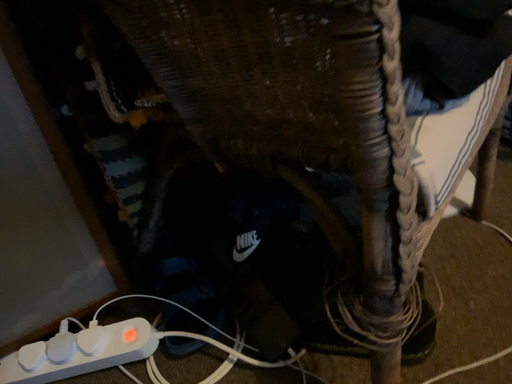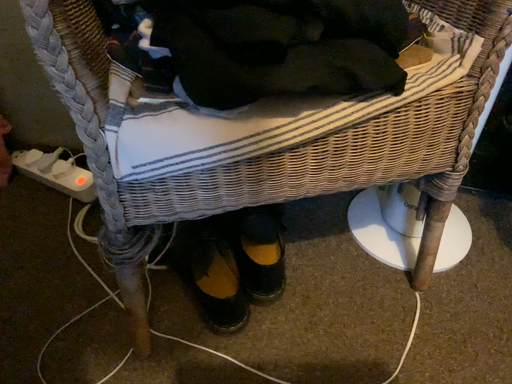
Question: Which way did the camera rotate in the video?

Choices:
 (A) rotated left
 (B) rotated right

Answer: (A)